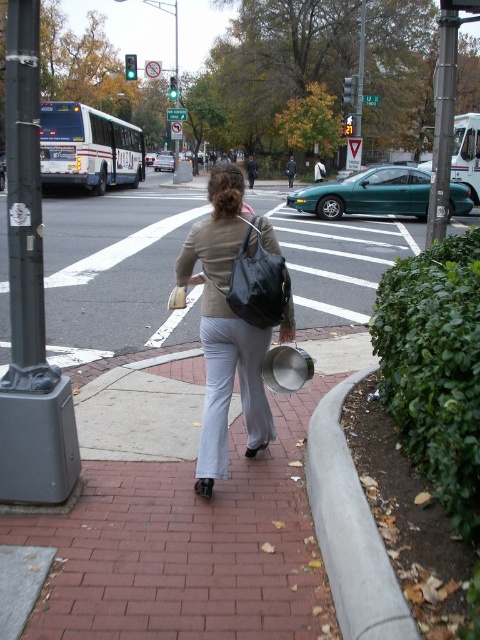
Based on the scene description, where is the gray concrete curb at lower right located in the image? Please provide its coordinates as a point in the format of a tuple with two decimal numbers between 0 and 1.

The gray concrete curb at lower right is located at coordinates approximately at point (350, 529).